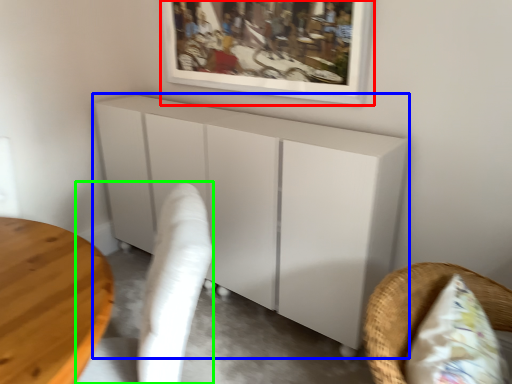
Question: Based on their relative distances, which object is farther from picture frame (highlighted by a red box)? Choose from furniture (highlighted by a blue box) and swivel chair (highlighted by a green box).

Choices:
 (A) furniture
 (B) swivel chair

Answer: (B)